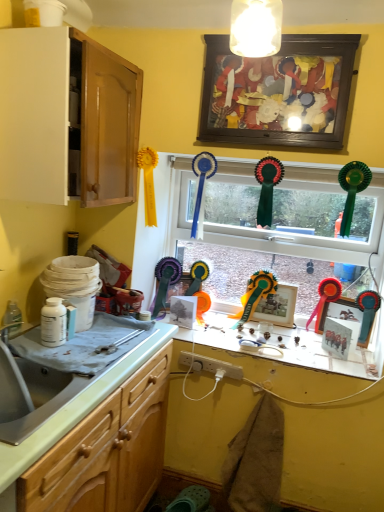
Describe the element at coordinates (107, 451) in the screenshot. I see `light wood cabinet at left, the 2th cabinetry from the top` at that location.

At what (x,y) coordinates should I click in order to perform the action: click on white glossy cabinet at upper left, which is the first cabinetry in top-to-bottom order. Please return your answer as a coordinate pair (x, y). Looking at the image, I should click on (67, 118).

What do you see at coordinates (67, 118) in the screenshot? I see `white glossy cabinet at upper left, which is the first cabinetry in top-to-bottom order` at bounding box center [67, 118].

This screenshot has width=384, height=512. What do you see at coordinates (278, 93) in the screenshot?
I see `wooden picture frame at upper center, which ranks as the first picture frame in top-to-bottom order` at bounding box center [278, 93].

Image resolution: width=384 pixels, height=512 pixels. Find the location of `wooden picture frame at upper center, which ranks as the first picture frame in top-to-bottom order`. wooden picture frame at upper center, which ranks as the first picture frame in top-to-bottom order is located at coordinates (278, 93).

Image resolution: width=384 pixels, height=512 pixels. Describe the element at coordinates (42, 397) in the screenshot. I see `silver metallic sink at lower left` at that location.

Find the location of `matte white light fixture at upper center`. matte white light fixture at upper center is located at coordinates (256, 27).

From the image's perspective, is light wood cabinet at left, the 2th cabinetry from the top, above white plastic plug at center?

Yes, from the image's perspective, light wood cabinet at left, the 2th cabinetry from the top, is over white plastic plug at center.

Is light wood cabinet at left, the 2th cabinetry from the top, facing towards white plastic plug at center?

Yes, light wood cabinet at left, the 2th cabinetry from the top, is aimed at white plastic plug at center.

From a real-world perspective, is light wood cabinet at left, the 2th cabinetry from the top, under white plastic plug at center?

No, from a real-world perspective, light wood cabinet at left, the 2th cabinetry from the top, is not beneath white plastic plug at center.

Does point (144, 494) lie in front of point (218, 365)?

Yes, point (144, 494) is in front of point (218, 365).

From a real-world perspective, which object rests below the other?

smooth white countertop at center, from a real-world perspective.

Is wooden picture frame at upper center, which ranks as the first picture frame in top-to-bottom order, positioned beyond the bounds of smooth white countertop at center?

Yes, wooden picture frame at upper center, which ranks as the first picture frame in top-to-bottom order, is located beyond the bounds of smooth white countertop at center.

Considering the positions of points (208, 75) and (306, 334), is point (208, 75) closer to camera compared to point (306, 334)?

Yes, point (208, 75) is closer to viewer.

Which of these two, light wood cabinet at left, the 2th cabinetry from the top, or metallic gold picture frame at center, the 2th picture frame from the top, stands shorter?

light wood cabinet at left, the 2th cabinetry from the top, is shorter.

Between light wood cabinet at left, which is the first cabinetry from bottom to top, and metallic gold picture frame at center, the fourth picture frame positioned from the bottom, which one is positioned behind?

metallic gold picture frame at center, the fourth picture frame positioned from the bottom, is further from the camera.

Which of these two, light wood cabinet at left, which is the first cabinetry from bottom to top, or metallic gold picture frame at center, the 2th picture frame from the top, is bigger?

light wood cabinet at left, which is the first cabinetry from bottom to top, is bigger.

Is light wood cabinet at left, which is the first cabinetry from bottom to top, in contact with metallic gold picture frame at center, the fourth picture frame positioned from the bottom?

They are not placed beside each other.

In terms of height, does white plastic plug at center look taller or shorter compared to silver metallic sink at lower left?

Clearly, white plastic plug at center is shorter compared to silver metallic sink at lower left.

How different are the orientations of white plastic plug at center and silver metallic sink at lower left in degrees?

The angle between the facing direction of white plastic plug at center and the facing direction of silver metallic sink at lower left is 90.5 degrees.

From the image's perspective, is white plastic plug at center above silver metallic sink at lower left?

No, from the image's perspective, white plastic plug at center is not above silver metallic sink at lower left.

Is point (201, 364) behind point (55, 393)?

Yes, point (201, 364) is farther from viewer.

Does metallic silver picture frame at right, the fifth picture frame in the top-to-bottom sequence, have a larger size compared to metallic gold picture frame at center, the fourth picture frame positioned from the bottom?

Incorrect, metallic silver picture frame at right, the fifth picture frame in the top-to-bottom sequence, is not larger than metallic gold picture frame at center, the fourth picture frame positioned from the bottom.

Which is behind, point (343, 325) or point (279, 305)?

Point (279, 305)

Considering the sizes of metallic silver picture frame at right, the fifth picture frame in the top-to-bottom sequence, and metallic gold picture frame at center, the fourth picture frame positioned from the bottom, in the image, is metallic silver picture frame at right, the fifth picture frame in the top-to-bottom sequence, wider or thinner than metallic gold picture frame at center, the fourth picture frame positioned from the bottom,?

Considering their sizes, metallic silver picture frame at right, the fifth picture frame in the top-to-bottom sequence, looks broader than metallic gold picture frame at center, the fourth picture frame positioned from the bottom.

Is glass window at center inside or outside of metallic silver picture frame at right, the fifth picture frame in the top-to-bottom sequence?

glass window at center cannot be found inside metallic silver picture frame at right, the fifth picture frame in the top-to-bottom sequence.

Is the surface of glass window at center in direct contact with metallic silver picture frame at right, the fifth picture frame in the top-to-bottom sequence?

They are not placed beside each other.

Considering the sizes of objects glass window at center and metallic silver picture frame at right, the fifth picture frame in the top-to-bottom sequence, in the image provided, who is shorter, glass window at center or metallic silver picture frame at right, the fifth picture frame in the top-to-bottom sequence,?

metallic silver picture frame at right, the fifth picture frame in the top-to-bottom sequence.

What's the angular difference between glass window at center and metallic silver picture frame at right, which is the first picture frame from bottom to top,'s facing directions?

The angular difference between glass window at center and metallic silver picture frame at right, which is the first picture frame from bottom to top, is 9.27 degrees.

From the image's perspective, does white glossy cabinet at upper left, marked as the 2th cabinetry in a bottom-to-top arrangement, appear higher than metallic silver picture frame at right, which is the first picture frame from bottom to top?

Yes, from the image's perspective, white glossy cabinet at upper left, marked as the 2th cabinetry in a bottom-to-top arrangement, is over metallic silver picture frame at right, which is the first picture frame from bottom to top.

Is metallic silver picture frame at right, which is the first picture frame from bottom to top, at the back of white glossy cabinet at upper left, marked as the 2th cabinetry in a bottom-to-top arrangement?

That's not correct — white glossy cabinet at upper left, marked as the 2th cabinetry in a bottom-to-top arrangement, is not looking away from metallic silver picture frame at right, which is the first picture frame from bottom to top.

Is point (80, 147) closer or farther from the camera than point (343, 333)?

Clearly, point (80, 147) is closer to the camera than point (343, 333).

Starting from the metallic silver picture frame at right, which is the first picture frame from bottom to top, which cabinetry is the 1st one to the left? Please provide its 2D coordinates.

[(67, 118)]

From the white plastic plug at center, count 2nd cabinetrys forward and point to it. Please provide its 2D coordinates.

[(107, 451)]

This screenshot has height=512, width=384. What are the coordinates of `counter top that appears behind the wooden picture frame at upper center, marked as the 5th picture frame in a bottom-to-top arrangement` in the screenshot? It's located at (285, 349).

Which object lies further to the anchor point smooth white countertop at center, white plastic plug at center or metallic silver picture frame at right, which is the second picture frame in bottom-to-top order?

metallic silver picture frame at right, which is the second picture frame in bottom-to-top order, lies further to smooth white countertop at center than the other object.

Considering their positions, is silver metallic sink at lower left positioned further to light wood cabinet at left, the 2th cabinetry from the top, than metallic silver picture frame at right, which is the first picture frame from bottom to top?

The object further to light wood cabinet at left, the 2th cabinetry from the top, is metallic silver picture frame at right, which is the first picture frame from bottom to top.

Looking at the image, which one is located closer to wooden picture frame at upper center, marked as the 5th picture frame in a bottom-to-top arrangement, smooth white countertop at center or white plastic plug at center?

smooth white countertop at center lies closer to wooden picture frame at upper center, marked as the 5th picture frame in a bottom-to-top arrangement, than the other object.

Considering their positions, is metallic silver picture frame at right, the 4th picture frame when ordered from top to bottom, positioned further to white plastic plug at center than metallic gold picture frame at center, the 2th picture frame from the top?

The object further to white plastic plug at center is metallic silver picture frame at right, the 4th picture frame when ordered from top to bottom.

Estimate the real-world distances between objects in this image. Which object is further from wooden picture frame at upper center, marked as the 5th picture frame in a bottom-to-top arrangement, metallic gold picture frame at center, the fourth picture frame positioned from the bottom, or white plastic plug at center?

white plastic plug at center is further to wooden picture frame at upper center, marked as the 5th picture frame in a bottom-to-top arrangement.

Consider the image. When comparing their distances from matte white light fixture at upper center, does glass window at center or light wood cabinet at left, the 2th cabinetry from the top, seem closer?

glass window at center lies closer to matte white light fixture at upper center than the other object.

When comparing their distances from wooden picture frame at upper center, which ranks as the first picture frame in top-to-bottom order, does metallic silver picture frame at right, the fifth picture frame in the top-to-bottom sequence, or white plastic plug at center seem closer?

metallic silver picture frame at right, the fifth picture frame in the top-to-bottom sequence.

From the image, which object appears to be nearer to metallic silver picture frame at right, which is the second picture frame in bottom-to-top order, light wood cabinet at left, which is the first cabinetry from bottom to top, or smooth white countertop at center?

smooth white countertop at center.

Identify the location of window between silver metallic sink at lower left and metallic gold picture frame at center, the fourth picture frame positioned from the bottom, in the front-back direction. (245, 239).

Find the location of a particular element. This screenshot has width=384, height=512. window between wooden picture frame at upper center, marked as the 5th picture frame in a bottom-to-top arrangement, and smooth white countertop at center, in the vertical direction is located at coordinates (245, 239).

The width and height of the screenshot is (384, 512). Identify the location of cabinetry between wooden picture frame at upper center, which ranks as the first picture frame in top-to-bottom order, and matte paper picture frame at center, the third picture frame in the bottom-to-top sequence, in the vertical direction. (67, 118).

I want to click on light fixture between white glossy cabinet at upper left, which is the first cabinetry in top-to-bottom order, and wooden picture frame at upper center, marked as the 5th picture frame in a bottom-to-top arrangement, so click(x=256, y=27).